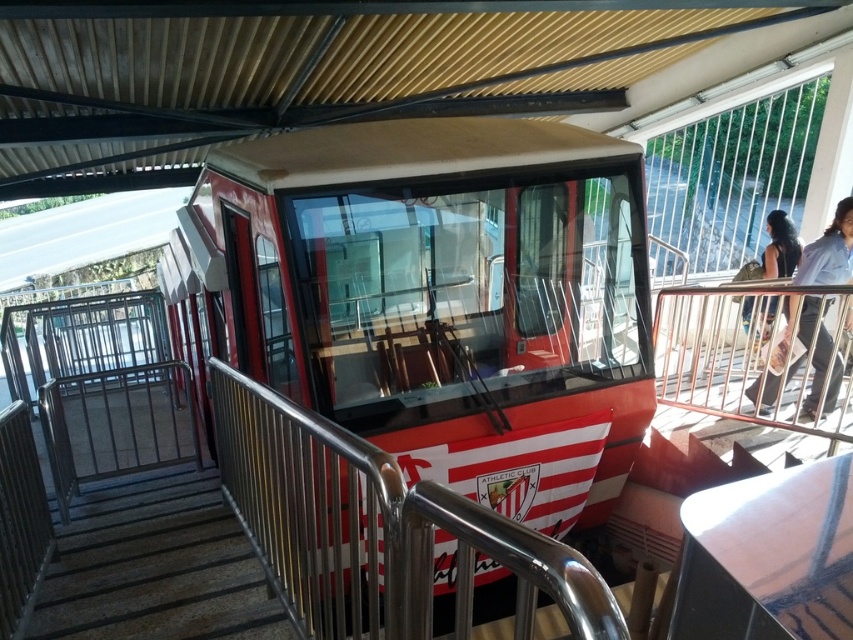
You are a person with average height standing at the base of the metallic gray stairs at lower left and looking towards the dark hair at upper right. Which object appears taller from your perspective?

The dark hair at upper right appears taller than the metallic gray stairs at lower left because the metallic gray stairs at lower left has a lesser height compared to dark hair at upper right.

You are a passenger waiting at the cable car station. You notice the red glossy train at center and the dark brown hair at upper right. Which object is positioned higher in the image?

The red glossy train at center is located above the dark brown hair at upper right, so it is positioned higher in the image.